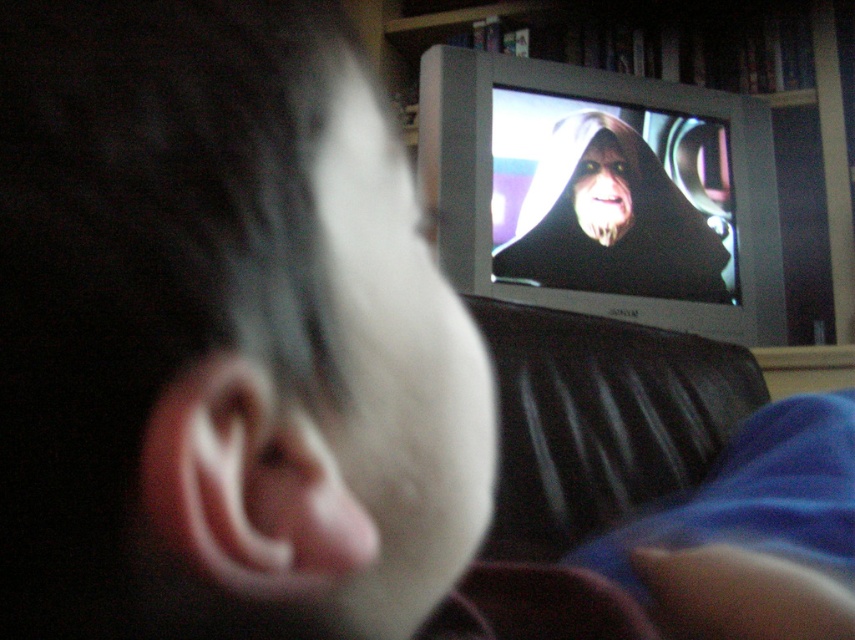
Question: Is wooden bookshelf at upper center wider than matte black hood at upper center?

Choices:
 (A) yes
 (B) no

Answer: (A)

Question: Which of the following is the closest to the observer?

Choices:
 (A) (628, 182)
 (B) (573, 211)

Answer: (B)

Question: Which of the following is the closest to the observer?

Choices:
 (A) (413, 16)
 (B) (549, 280)
 (C) (581, 156)

Answer: (B)

Question: Which object appears closest to the camera in this image?

Choices:
 (A) white matte pillow at center
 (B) matte black face at center
 (C) wooden bookshelf at upper center
 (D) matte black hood at upper center

Answer: (A)

Question: Does wooden bookshelf at upper center appear over matte black hood at upper center?

Choices:
 (A) yes
 (B) no

Answer: (A)

Question: Does wooden bookshelf at upper center have a lesser width compared to matte black face at center?

Choices:
 (A) yes
 (B) no

Answer: (B)